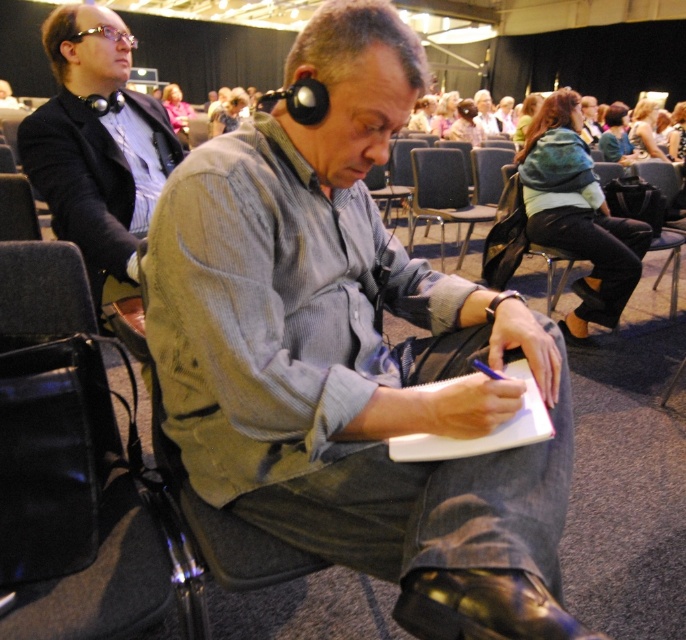
Question: Does matte gray shirt at center appear on the left side of black leather bag at lower left?

Choices:
 (A) yes
 (B) no

Answer: (B)

Question: Which point is farther from the camera taking this photo?

Choices:
 (A) (490, 554)
 (B) (412, 154)
 (C) (82, 397)

Answer: (B)

Question: Which of the following is the closest to the observer?

Choices:
 (A) matte gray shirt at center
 (B) matte black headphones at upper left
 (C) black leather bag at lower left
 (D) blue fabric chair at center

Answer: (A)

Question: Does black leather bag at lower left have a smaller size compared to matte black headphones at upper left?

Choices:
 (A) no
 (B) yes

Answer: (B)

Question: Which of the following is the closest to the observer?

Choices:
 (A) (104, 384)
 (B) (130, 184)

Answer: (A)

Question: Is black leather bag at lower left bigger than matte black headphones at upper left?

Choices:
 (A) yes
 (B) no

Answer: (B)